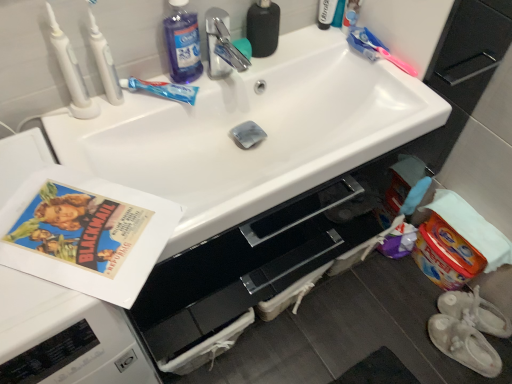
Where is `free space to the left of white fabric baby shoes at lower right, marked as the 1th footwear in a back-to-front arrangement`? free space to the left of white fabric baby shoes at lower right, marked as the 1th footwear in a back-to-front arrangement is located at coordinates click(x=411, y=311).